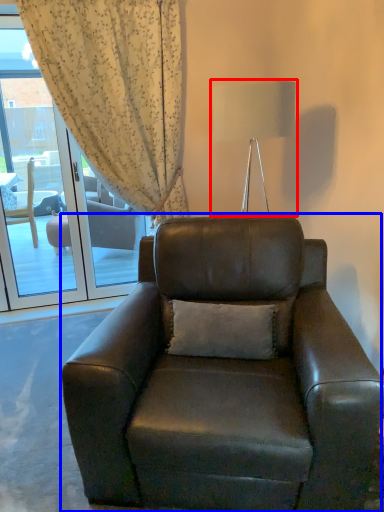
Question: Which object appears farthest to the camera in this image, lamp (highlighted by a red box) or chair (highlighted by a blue box)?

Choices:
 (A) lamp
 (B) chair

Answer: (A)